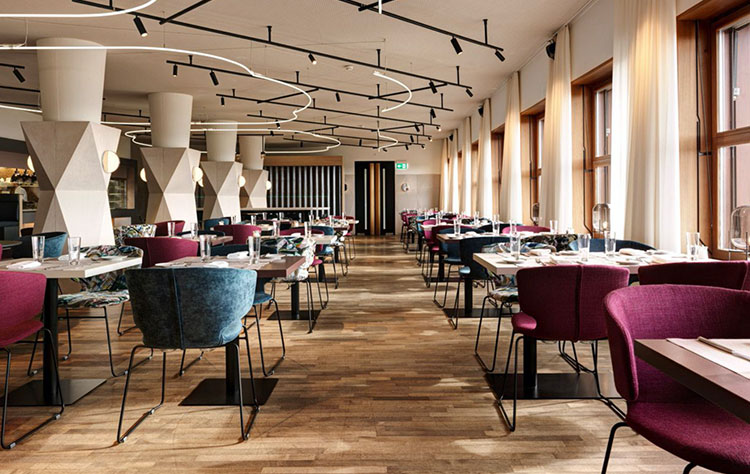
The width and height of the screenshot is (750, 474). I want to click on pillars, so click(x=78, y=91), click(x=162, y=117), click(x=218, y=140), click(x=254, y=148).